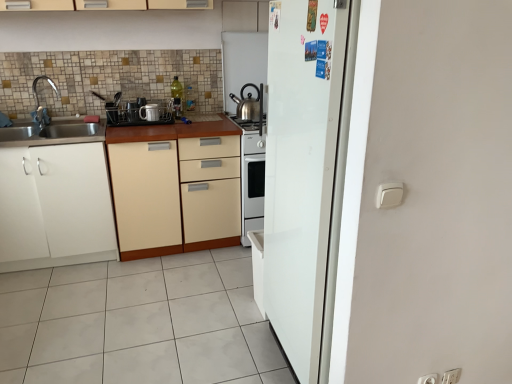
I want to click on vacant space in front of metallic silver pot at center, which is the 2th appliance in left-to-right order, so click(141, 129).